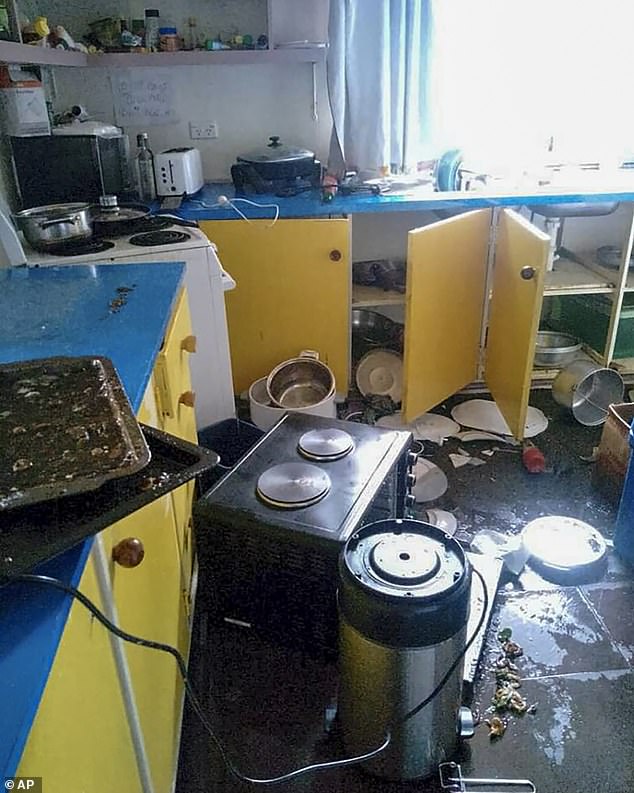
This screenshot has width=634, height=793. Identify the location of curtain. (392, 67).